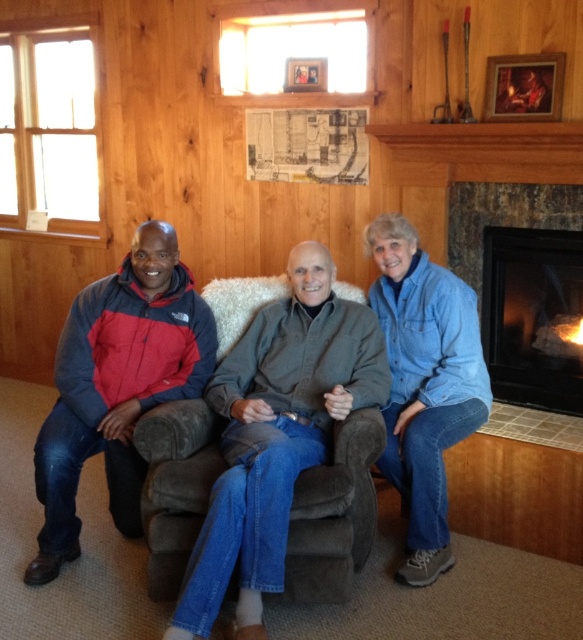
Is denim jacket at center to the right of black stone fireplace at right from the viewer's perspective?

No, denim jacket at center is not to the right of black stone fireplace at right.

Is point (251, 572) farther from camera compared to point (531, 372)?

No, it is not.

This screenshot has width=583, height=640. What are the coordinates of `denim jacket at center` in the screenshot? It's located at (332, 417).

Does denim jeans at center have a greater height compared to red and blue nylon jacket at left?

Incorrect, denim jeans at center's height is not larger of red and blue nylon jacket at left's.

Who is higher up, denim jeans at center or red and blue nylon jacket at left?

Positioned higher is red and blue nylon jacket at left.

Who is more distant from viewer, (292, 390) or (127, 339)?

The point (127, 339) is more distant.

Locate an element on the screen. This screenshot has width=583, height=640. denim jeans at center is located at coordinates (276, 435).

Does red and blue nylon jacket at left lie in front of denim jacket at lower right?

That is True.

Does red and blue nylon jacket at left appear on the right side of denim jacket at lower right?

No, red and blue nylon jacket at left is not to the right of denim jacket at lower right.

Image resolution: width=583 pixels, height=640 pixels. I want to click on red and blue nylon jacket at left, so click(x=117, y=385).

This screenshot has height=640, width=583. Identify the location of red and blue nylon jacket at left. (117, 385).